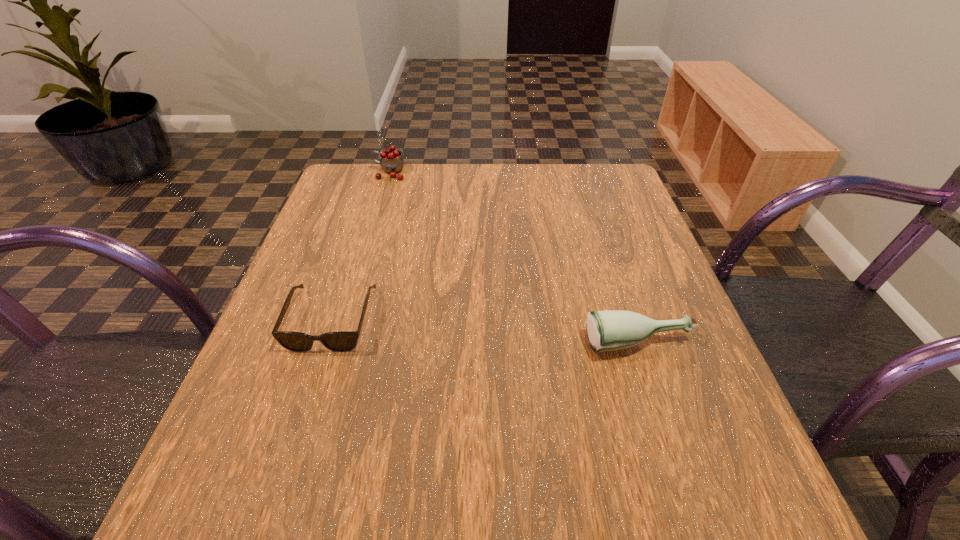
At what (x,y) coordinates should I click in order to perform the action: click on object at the far edge. Please return your answer as a coordinate pair (x, y). The image size is (960, 540). Looking at the image, I should click on (392, 162).

You are a GUI agent. You are given a task and a screenshot of the screen. Output one action in this format:
    pyautogui.click(x=<x>, y=<y>)
    Task: Click on the cherry at the left edge
    The image size is (960, 540).
    Given the screenshot: What is the action you would take?
    pyautogui.click(x=392, y=162)

Where is `sunglasses positioned at the left edge`? The height and width of the screenshot is (540, 960). sunglasses positioned at the left edge is located at coordinates (341, 341).

Find the location of a particular element. This screenshot has width=960, height=540. object that is at the right edge is located at coordinates (610, 330).

Locate an element on the screen. This screenshot has height=540, width=960. object that is at the far left corner is located at coordinates (392, 162).

The width and height of the screenshot is (960, 540). In the image, there is a desktop. In order to click on vacant space at the far edge in this screenshot , I will do `click(542, 184)`.

Find the location of a particular element. vacant space at the near edge of the desktop is located at coordinates (468, 505).

This screenshot has width=960, height=540. Identify the location of free spot at the left edge of the desktop. (306, 422).

Locate an element on the screen. free space at the right edge is located at coordinates (678, 360).

Identify the location of vacant space at the far left corner of the desktop. The image size is (960, 540). (368, 201).